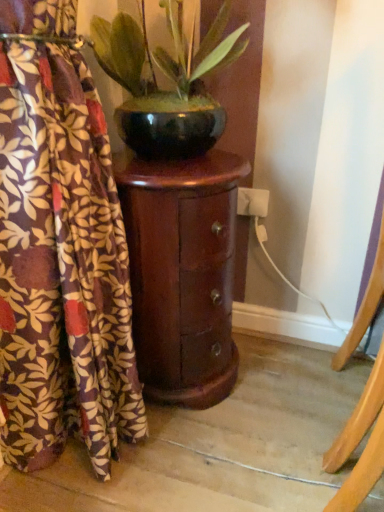
Question: Is brown floral fabric at left facing towards shiny black pot at center?

Choices:
 (A) yes
 (B) no

Answer: (B)

Question: Can shiny black pot at center be found inside brown floral fabric at left?

Choices:
 (A) yes
 (B) no

Answer: (B)

Question: Is brown floral fabric at left beside shiny black pot at center?

Choices:
 (A) no
 (B) yes

Answer: (A)

Question: Does brown floral fabric at left appear on the left side of shiny black pot at center?

Choices:
 (A) yes
 (B) no

Answer: (A)

Question: Is brown floral fabric at left outside of shiny black pot at center?

Choices:
 (A) yes
 (B) no

Answer: (A)

Question: Is the depth of brown floral fabric at left greater than that of shiny black pot at center?

Choices:
 (A) no
 (B) yes

Answer: (A)

Question: Would you say shiny black pot at center is outside shiny dark wood cabinet at center?

Choices:
 (A) yes
 (B) no

Answer: (A)

Question: Is shiny black pot at center positioned before shiny dark wood cabinet at center?

Choices:
 (A) yes
 (B) no

Answer: (A)

Question: From the image's perspective, would you say shiny black pot at center is positioned over shiny dark wood cabinet at center?

Choices:
 (A) yes
 (B) no

Answer: (A)

Question: From a real-world perspective, is shiny black pot at center positioned over shiny dark wood cabinet at center based on gravity?

Choices:
 (A) yes
 (B) no

Answer: (A)

Question: From a real-world perspective, is shiny black pot at center below shiny dark wood cabinet at center?

Choices:
 (A) no
 (B) yes

Answer: (A)

Question: Is shiny black pot at center to the right of shiny dark wood cabinet at center from the viewer's perspective?

Choices:
 (A) no
 (B) yes

Answer: (B)

Question: From a real-world perspective, is brown floral fabric at left physically below shiny dark wood cabinet at center?

Choices:
 (A) yes
 (B) no

Answer: (B)